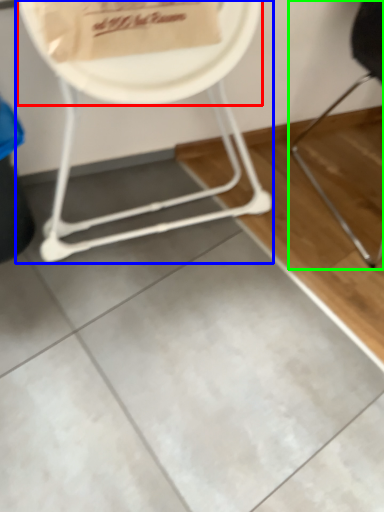
Question: Which object is positioned closest to paper plate (highlighted by a red box)? Select from chair (highlighted by a blue box) and chair (highlighted by a green box).

Choices:
 (A) chair
 (B) chair

Answer: (A)